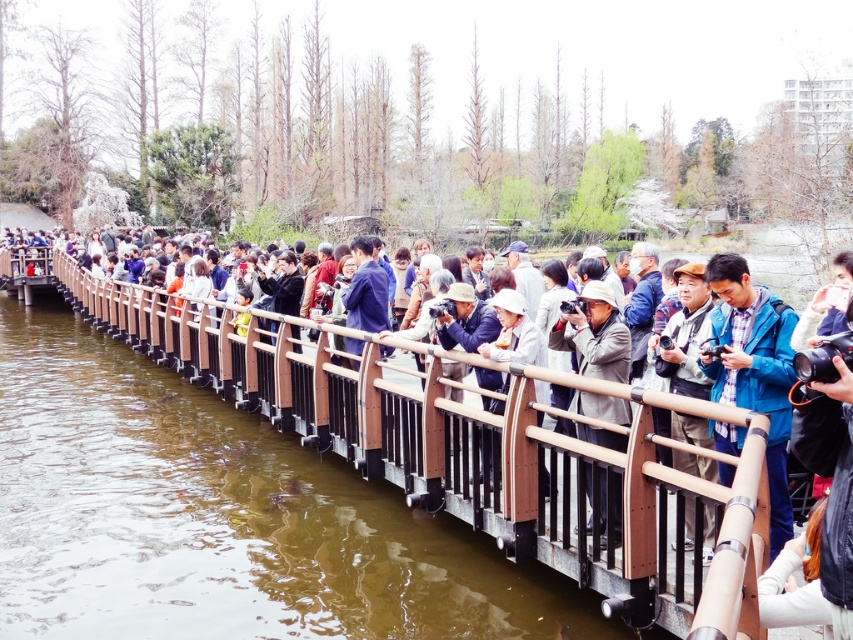
You are a photographer standing on the brown wooden bridge at center holding the matte brown camera at center. You want to take a photo of the water below. Since the camera is positioned at your eye level, will you need to look up or down to frame the shot?

The brown wooden bridge at center is taller than the matte brown camera at center. Since the camera is at your eye level, you will need to look down to frame the shot of the water below.

You are a photographer standing on the wooden bridge and you have both the gray fabric hat at center and the matte brown camera at center in your view. Which object is blocking your view of the other?

The gray fabric hat at center is positioned over the matte brown camera at center, so the gray fabric hat at center is blocking the view of the matte brown camera at center.